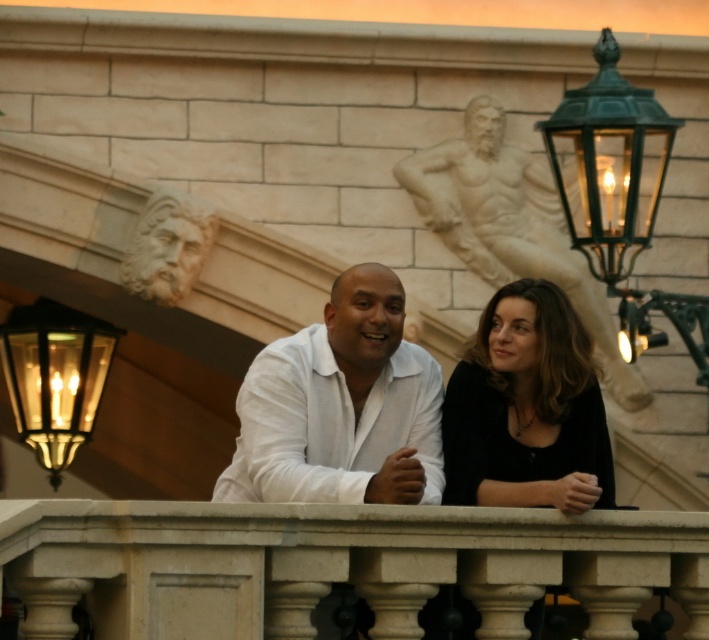
Who is more forward, (608, 285) or (491, 102)?

Positioned in front is point (608, 285).

Describe the element at coordinates (619, 196) in the screenshot. I see `green glass lantern at upper right` at that location.

Which is behind, point (610, 276) or point (530, 241)?

Point (530, 241)

Locate an element on the screen. green glass lantern at upper right is located at coordinates (619, 196).

Who is higher up, white marble balustrade at center or white matte shirt at center?

Positioned higher is white matte shirt at center.

Looking at this image, between white marble balustrade at center and white matte shirt at center, which one is positioned lower?

Positioned lower is white marble balustrade at center.

Measure the distance between point [116,554] and camera.

Point [116,554] and camera are 140.19 feet apart from each other.

What are the coordinates of `white marble balustrade at center` in the screenshot? It's located at [335, 564].

This screenshot has height=640, width=709. What do you see at coordinates (525, 408) in the screenshot?
I see `black matte shirt at center` at bounding box center [525, 408].

Based on the photo, between black matte shirt at center and matte brass lantern at left, which one is positioned higher?

black matte shirt at center is higher up.

You are a GUI agent. You are given a task and a screenshot of the screen. Output one action in this format:
    pyautogui.click(x=<x>, y=<y>)
    Task: Click on the black matte shirt at center
    Image resolution: width=709 pixels, height=640 pixels.
    Given the screenshot: What is the action you would take?
    pyautogui.click(x=525, y=408)

Find the location of a particular element. Image resolution: width=709 pixels, height=640 pixels. black matte shirt at center is located at coordinates (525, 408).